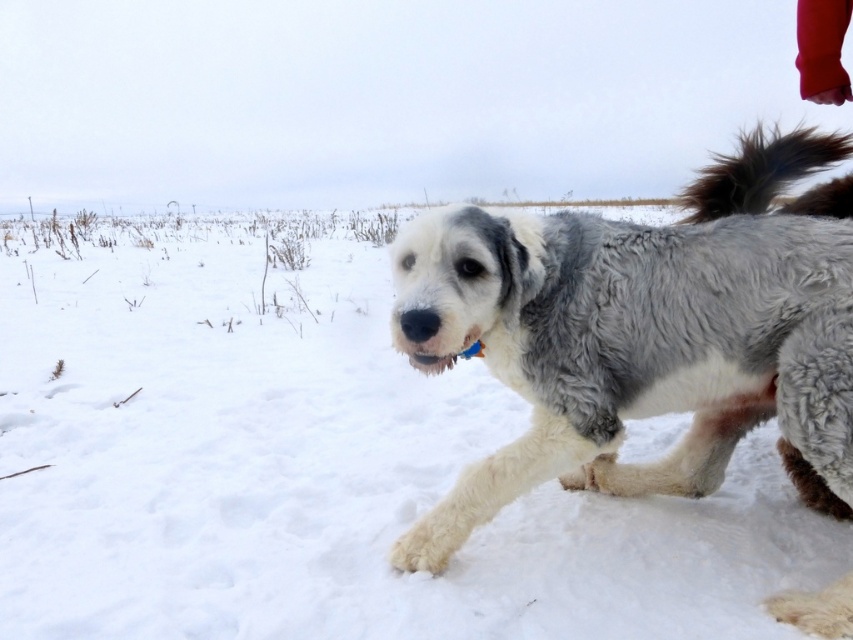
Question: Among these points, which one is nearest to the camera?

Choices:
 (A) (782, 164)
 (B) (479, 252)

Answer: (B)

Question: Can you confirm if fuzzy gray dog at center is bigger than brown fluffy tail at upper right?

Choices:
 (A) yes
 (B) no

Answer: (A)

Question: Is white fluffy snow at center above brown fluffy tail at upper right?

Choices:
 (A) no
 (B) yes

Answer: (A)

Question: Which object appears closest to the camera in this image?

Choices:
 (A) fuzzy gray dog at center
 (B) brown fluffy tail at upper right

Answer: (A)

Question: Among these objects, which one is farthest from the camera?

Choices:
 (A) white fluffy snow at center
 (B) fuzzy gray dog at center

Answer: (A)

Question: Does white fluffy snow at center appear under brown fluffy tail at upper right?

Choices:
 (A) yes
 (B) no

Answer: (A)